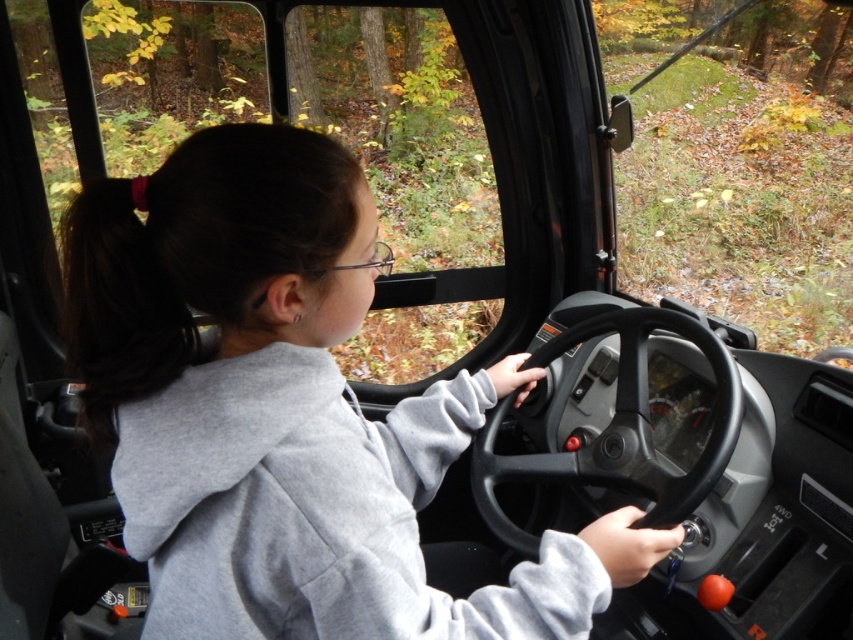
Question: Is dark brown hair at left below black rubber steering wheel at center?

Choices:
 (A) yes
 (B) no

Answer: (B)

Question: Can you confirm if dark brown hair at left is positioned above black rubber steering wheel at center?

Choices:
 (A) yes
 (B) no

Answer: (A)

Question: Does dark brown hair at left appear on the left side of black rubber steering wheel at center?

Choices:
 (A) yes
 (B) no

Answer: (A)